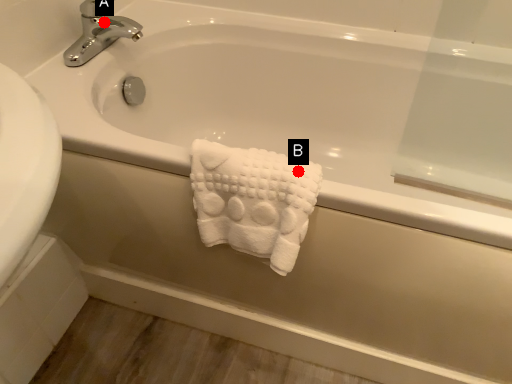
Question: Two points are circled on the image, labeled by A and B beside each circle. Among these points, which one is farthest from the camera?

Choices:
 (A) A is further
 (B) B is further

Answer: (A)